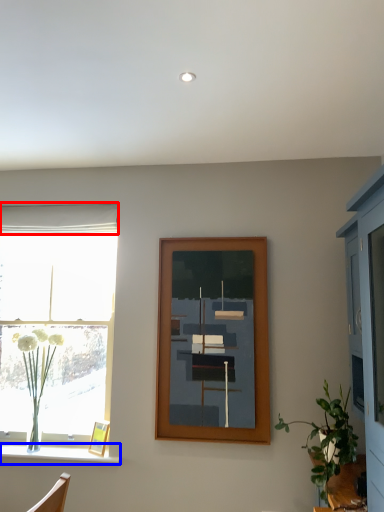
Question: Which point is closer to the camera, curtain (highlighted by a red box) or window sill (highlighted by a blue box)?

Choices:
 (A) curtain
 (B) window sill

Answer: (B)